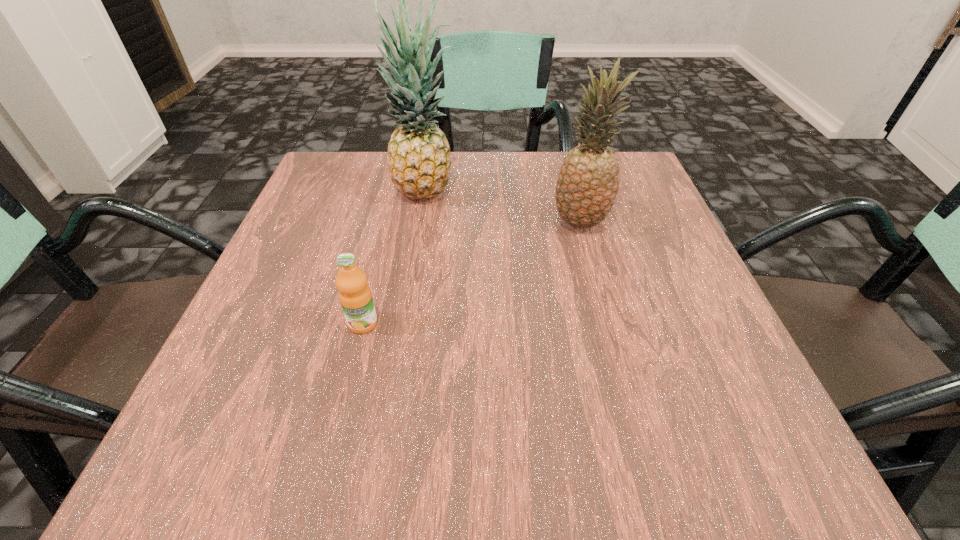
Identify the location of vacant region between the orange juice and the tallest object. (395, 259).

Identify the location of free spot between the second tallest object and the left pineapple. The width and height of the screenshot is (960, 540). (503, 208).

I want to click on vacant point located between the left pineapple and the second tallest object, so click(503, 208).

Image resolution: width=960 pixels, height=540 pixels. I want to click on free point between the taller pineapple and the rightmost object, so click(x=503, y=208).

Image resolution: width=960 pixels, height=540 pixels. Find the location of `free space between the rightmost object and the nearest object`. free space between the rightmost object and the nearest object is located at coordinates (471, 273).

Identify the location of vacant area that lies between the second tallest object and the left pineapple. (503, 208).

Locate an element on the screen. object that stands as the closest to the left pineapple is located at coordinates coord(588,182).

Identify the location of object that is the closest to the taller pineapple. (588, 182).

What are the coordinates of `vacant position in the image that satisfies the following two spatial constraints: 1. on the front side of the tallest object; 2. on the left side of the right pineapple` in the screenshot? It's located at (421, 222).